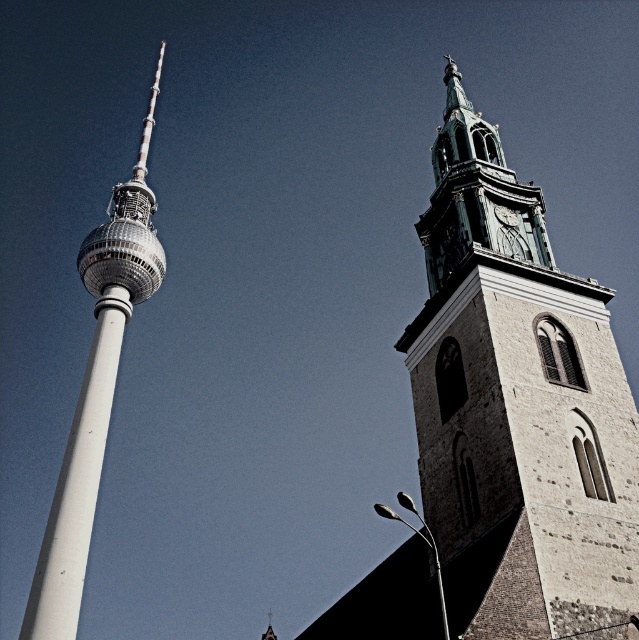
You are a photographer standing in front of the Fernsehturm and the Church of Our Lady. You want to take a photo that includes both landmarks. However, you notice two points marked in the scene at coordinates point (x=520, y=513) and point (x=89, y=392). Which of these points is closer to your camera position?

Point (x=520, y=513) is closer to the camera than point (x=89, y=392).

You are standing at a point marked as point [427,506] in the image. You want to take a photo of both the Fernsehturm and the Frauenkirche without any obstructions. Considering the distance from your current position to the camera, is it feasible to capture both structures in a single frame?

The distance from point [427,506] to the camera is 127.24 feet. Since both the Fernsehturm and Frauenkirche are visible landmarks in Berlin and positioned on opposite sides of the image, it is feasible to capture both in a single frame from this distance, provided the camera has an appropriate wide angle lens or zoom capability.

You are standing in the middle of the square between the stone tower at right and the white smooth pole at left. Which structure is closer to your right side?

The stone tower at right is to the right of the white smooth pole at left, so when standing between them in the middle of the square, the stone tower at right will be on your right side.